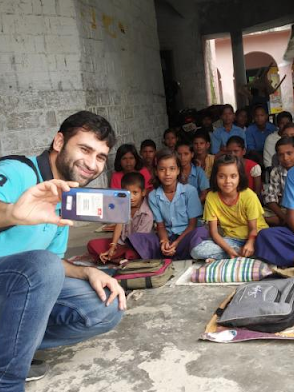
Locate an element on the screen. This screenshot has height=392, width=294. pillar is located at coordinates (239, 59).